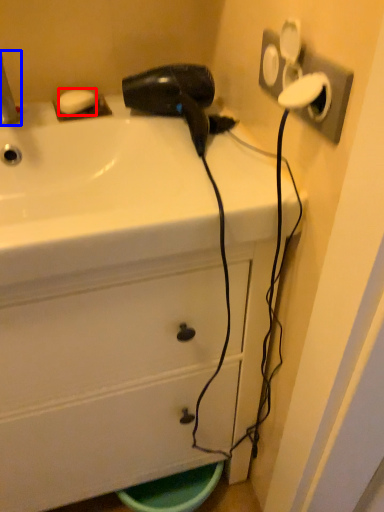
Question: Which point is further to the camera, soap (highlighted by a red box) or faucet (highlighted by a blue box)?

Choices:
 (A) soap
 (B) faucet

Answer: (A)